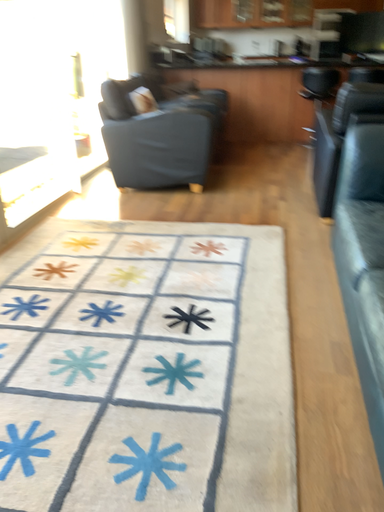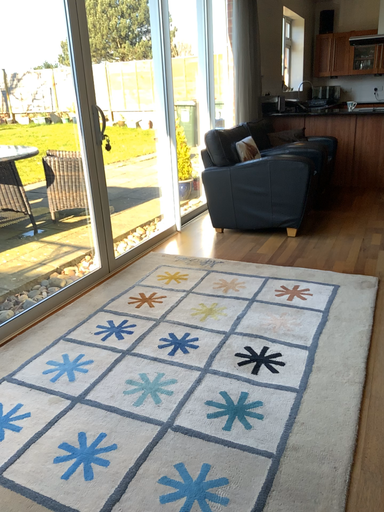
Question: Which way did the camera rotate in the video?

Choices:
 (A) rotated right
 (B) rotated left

Answer: (B)